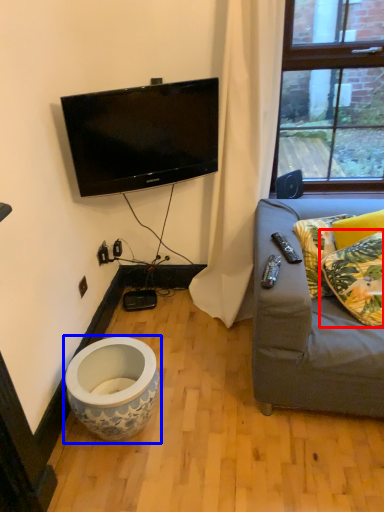
Question: Which object is further to the camera taking this photo, pillow (highlighted by a red box) or toilet (highlighted by a blue box)?

Choices:
 (A) pillow
 (B) toilet

Answer: (B)